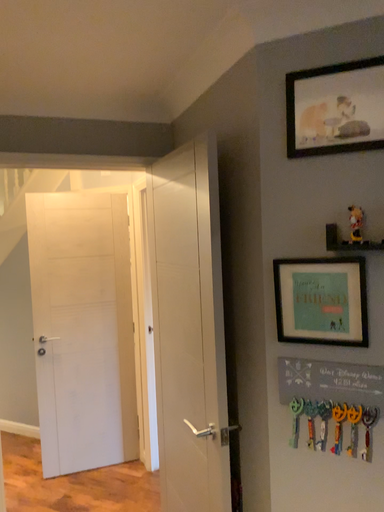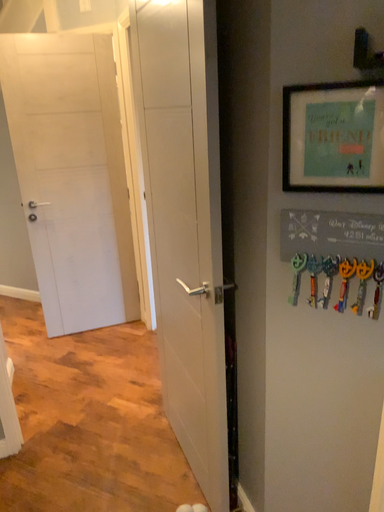
Question: How did the camera likely rotate when shooting the video?

Choices:
 (A) rotated downward
 (B) rotated upward

Answer: (A)